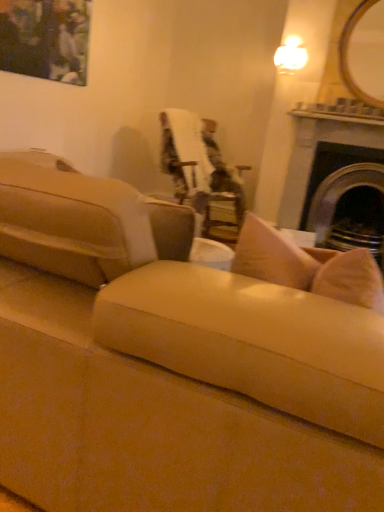
Question: Does matte black painting at upper left appear on the left side of suede beige couch at center, the 2th studio couch from the right?

Choices:
 (A) yes
 (B) no

Answer: (A)

Question: Can you confirm if matte black painting at upper left is bigger than suede beige couch at center, the 2th studio couch from the right?

Choices:
 (A) yes
 (B) no

Answer: (B)

Question: From the image's perspective, would you say matte black painting at upper left is positioned over suede beige couch at center, the 2th studio couch from the right?

Choices:
 (A) no
 (B) yes

Answer: (B)

Question: Is matte black painting at upper left behind suede beige couch at center, the first studio couch when ordered from left to right?

Choices:
 (A) yes
 (B) no

Answer: (A)

Question: Is matte black painting at upper left looking in the opposite direction of suede beige couch at center, the first studio couch when ordered from left to right?

Choices:
 (A) no
 (B) yes

Answer: (A)

Question: Is dark gray stone fireplace at right in front of or behind wooden framed mirror at upper right in the image?

Choices:
 (A) behind
 (B) front

Answer: (A)

Question: Is dark gray stone fireplace at right to the left or to the right of wooden framed mirror at upper right in the image?

Choices:
 (A) right
 (B) left

Answer: (A)

Question: Looking at their shapes, would you say dark gray stone fireplace at right is wider or thinner than wooden framed mirror at upper right?

Choices:
 (A) wide
 (B) thin

Answer: (A)

Question: Looking at the image, does dark gray stone fireplace at right seem bigger or smaller compared to wooden framed mirror at upper right?

Choices:
 (A) big
 (B) small

Answer: (A)

Question: Considering their positions, is velvet upholstered chair at center located in front of or behind matte black painting at upper left?

Choices:
 (A) front
 (B) behind

Answer: (B)

Question: Is velvet upholstered chair at center wider or thinner than matte black painting at upper left?

Choices:
 (A) thin
 (B) wide

Answer: (B)

Question: Is velvet upholstered chair at center inside or outside of matte black painting at upper left?

Choices:
 (A) outside
 (B) inside

Answer: (A)

Question: In terms of size, does velvet upholstered chair at center appear bigger or smaller than matte black painting at upper left?

Choices:
 (A) small
 (B) big

Answer: (B)

Question: Considering the positions of suede beige couch at center, the first studio couch when ordered from left to right, and wooden framed mirror at upper right in the image, is suede beige couch at center, the first studio couch when ordered from left to right, bigger or smaller than wooden framed mirror at upper right?

Choices:
 (A) small
 (B) big

Answer: (B)

Question: Is suede beige couch at center, the first studio couch when ordered from left to right, taller or shorter than wooden framed mirror at upper right?

Choices:
 (A) tall
 (B) short

Answer: (B)